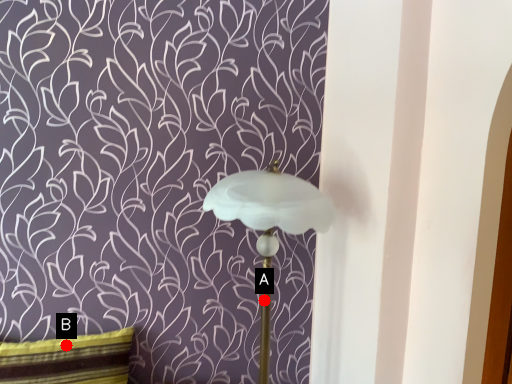
Question: Two points are circled on the image, labeled by A and B beside each circle. Which point is closer to the camera?

Choices:
 (A) A is closer
 (B) B is closer

Answer: (A)